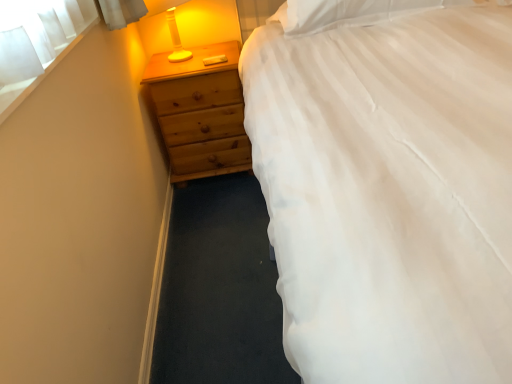
Question: Is white fabric at upper left wider than white soft pillow at upper right?

Choices:
 (A) yes
 (B) no

Answer: (B)

Question: Would you consider white fabric at upper left to be distant from white soft pillow at upper right?

Choices:
 (A) no
 (B) yes

Answer: (A)

Question: Does white fabric at upper left come behind white soft pillow at upper right?

Choices:
 (A) no
 (B) yes

Answer: (A)

Question: From the image's perspective, is white fabric at upper left over white soft pillow at upper right?

Choices:
 (A) no
 (B) yes

Answer: (A)

Question: Is white fabric at upper left to the left of white soft pillow at upper right from the viewer's perspective?

Choices:
 (A) no
 (B) yes

Answer: (B)

Question: In terms of height, does wooden chest of drawers at left look taller or shorter compared to white fabric at upper left?

Choices:
 (A) short
 (B) tall

Answer: (B)

Question: Considering the positions of wooden chest of drawers at left and white fabric at upper left in the image, is wooden chest of drawers at left bigger or smaller than white fabric at upper left?

Choices:
 (A) small
 (B) big

Answer: (B)

Question: From the image's perspective, is wooden chest of drawers at left positioned above or below white fabric at upper left?

Choices:
 (A) above
 (B) below

Answer: (A)

Question: From a real-world perspective, is wooden chest of drawers at left positioned above or below white fabric at upper left?

Choices:
 (A) above
 (B) below

Answer: (B)

Question: Is white fabric at upper left to the left or to the right of white soft pillow at upper right in the image?

Choices:
 (A) right
 (B) left

Answer: (B)

Question: Is white fabric at upper left bigger or smaller than white soft pillow at upper right?

Choices:
 (A) big
 (B) small

Answer: (B)

Question: From the image's perspective, is white fabric at upper left positioned above or below white soft pillow at upper right?

Choices:
 (A) below
 (B) above

Answer: (A)

Question: In terms of width, does white fabric at upper left look wider or thinner when compared to white soft pillow at upper right?

Choices:
 (A) wide
 (B) thin

Answer: (B)

Question: Is white soft pillow at upper right inside the boundaries of white fabric at upper left, or outside?

Choices:
 (A) inside
 (B) outside

Answer: (B)

Question: Is white soft pillow at upper right in front of or behind white fabric at upper left in the image?

Choices:
 (A) behind
 (B) front

Answer: (A)